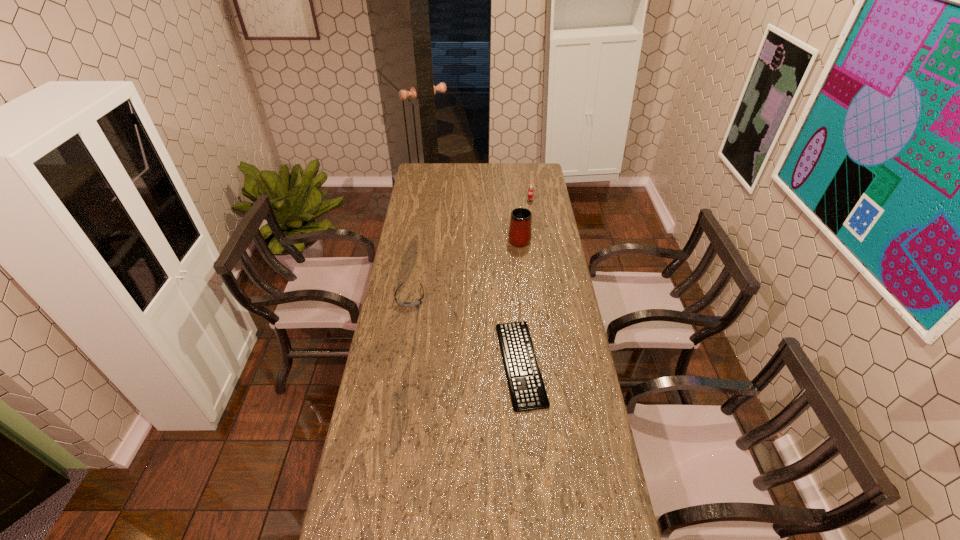
Locate which object ranks second in proximity to the tallest object. Please provide its 2D coordinates. Your answer should be formatted as a tuple, i.e. [(x, y)], where the tuple contains the x and y coordinates of a point satisfying the conditions above.

[(403, 304)]

This screenshot has width=960, height=540. I want to click on vacant space that satisfies the following two spatial constraints: 1. on the lenses of the computer keyboard; 2. on the right side of the sunglasses, so click(399, 363).

The height and width of the screenshot is (540, 960). I want to click on vacant space that satisfies the following two spatial constraints: 1. on the lenses of the computer keyboard; 2. on the right side of the leftmost object, so click(399, 363).